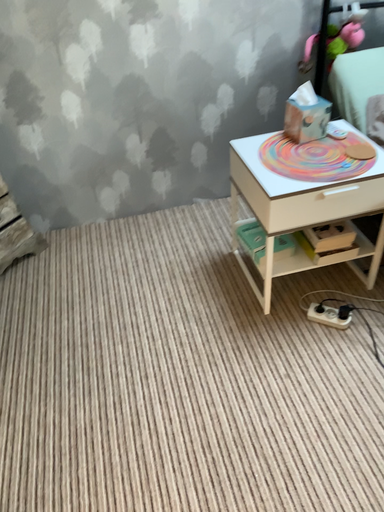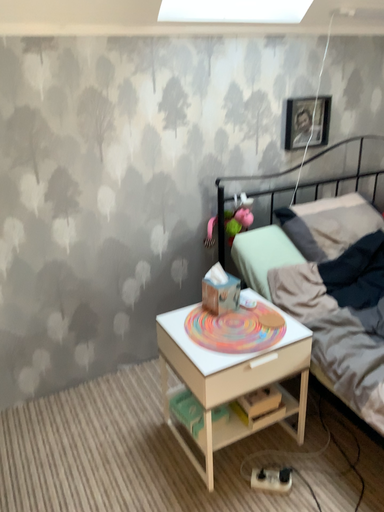
Question: Which way did the camera rotate in the video?

Choices:
 (A) rotated left
 (B) rotated right

Answer: (B)